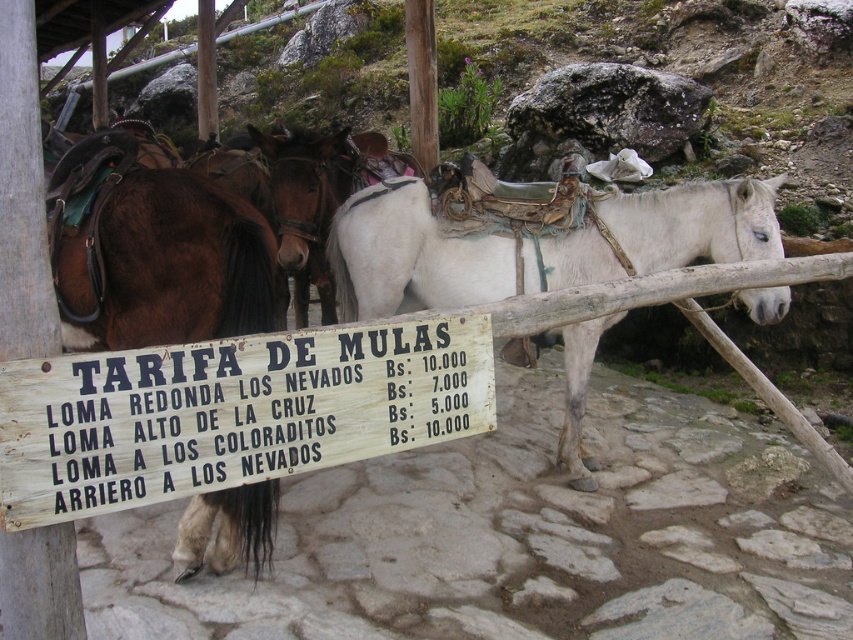
Question: Which object is closer to the camera taking this photo?

Choices:
 (A) white leather horse at center
 (B) brown glossy horse at left

Answer: (B)

Question: Which of the following is the closest to the observer?

Choices:
 (A) black wood sign at center
 (B) white leather horse at center

Answer: (A)

Question: Is black wood sign at center smaller than white leather horse at center?

Choices:
 (A) no
 (B) yes

Answer: (B)

Question: Does black wood sign at center appear on the right side of brown glossy horse at left?

Choices:
 (A) no
 (B) yes

Answer: (B)

Question: Among these points, which one is nearest to the camera?

Choices:
 (A) (57, 484)
 (B) (51, 268)
 (C) (368, 234)

Answer: (A)

Question: Is black wood sign at center bigger than brown glossy horse at left?

Choices:
 (A) yes
 (B) no

Answer: (B)